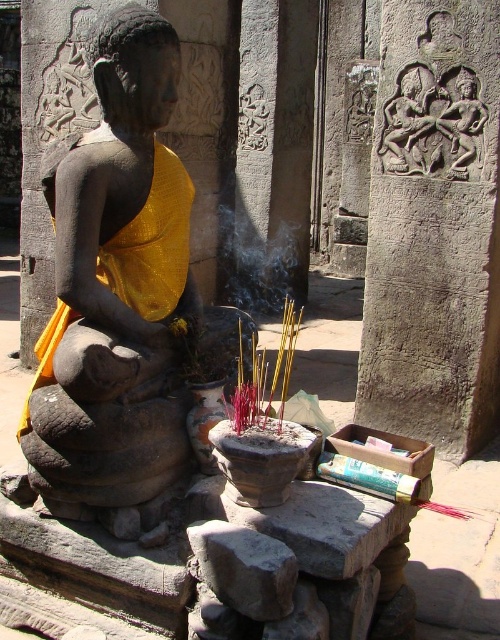
Question: Which of the following is the farthest from the observer?

Choices:
 (A) carved stone relief at upper right
 (B) smoketransparent at center
 (C) yellow fabric at center
 (D) carved stone figure at upper right

Answer: (B)

Question: Is carved stone relief at upper right bigger than carved stone figure at upper right?

Choices:
 (A) no
 (B) yes

Answer: (B)

Question: Considering the real-world distances, which object is farthest from the carved stone figure at upper right?

Choices:
 (A) smoketransparent at center
 (B) carved stone relief at upper right
 (C) yellow fabric at center

Answer: (A)

Question: Is carved stone relief at upper right positioned behind smoketransparent at center?

Choices:
 (A) yes
 (B) no

Answer: (B)

Question: Does yellow fabric at center appear under smoketransparent at center?

Choices:
 (A) no
 (B) yes

Answer: (B)

Question: Which object is farther from the camera taking this photo?

Choices:
 (A) carved stone relief at upper right
 (B) smoketransparent at center
 (C) yellow fabric at center
 (D) matte stone statue at center

Answer: (B)